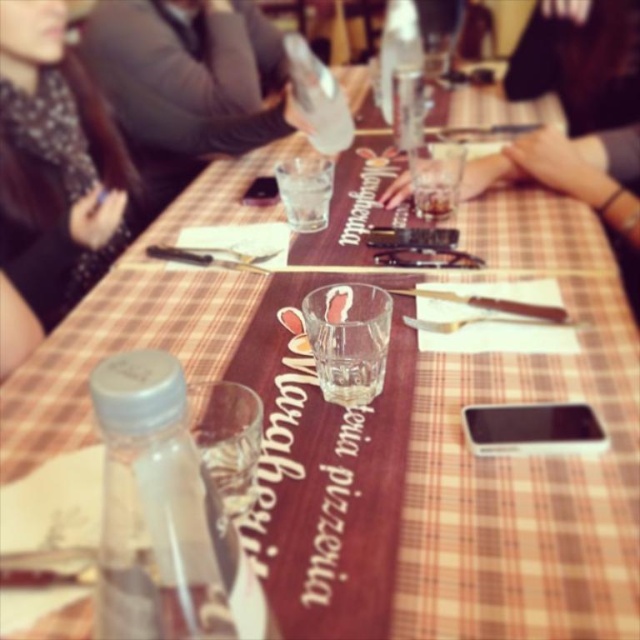
Who is higher up, black fabric scarf at upper left or translucent glass at center?

Positioned higher is black fabric scarf at upper left.

Based on the photo, measure the distance from black fabric scarf at upper left to translucent glass at center.

A distance of 19.98 inches exists between black fabric scarf at upper left and translucent glass at center.

This screenshot has height=640, width=640. What are the coordinates of `black fabric scarf at upper left` in the screenshot? It's located at pos(51,177).